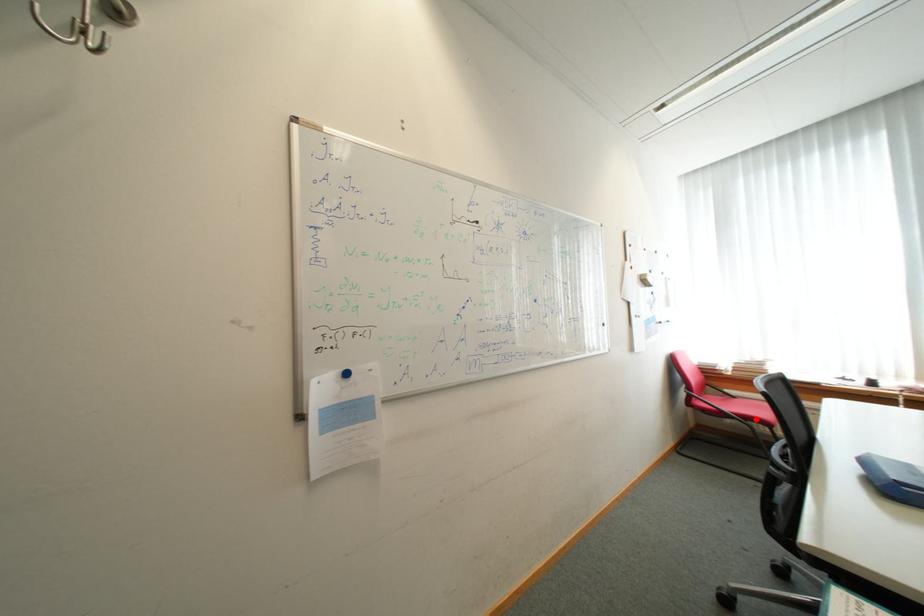
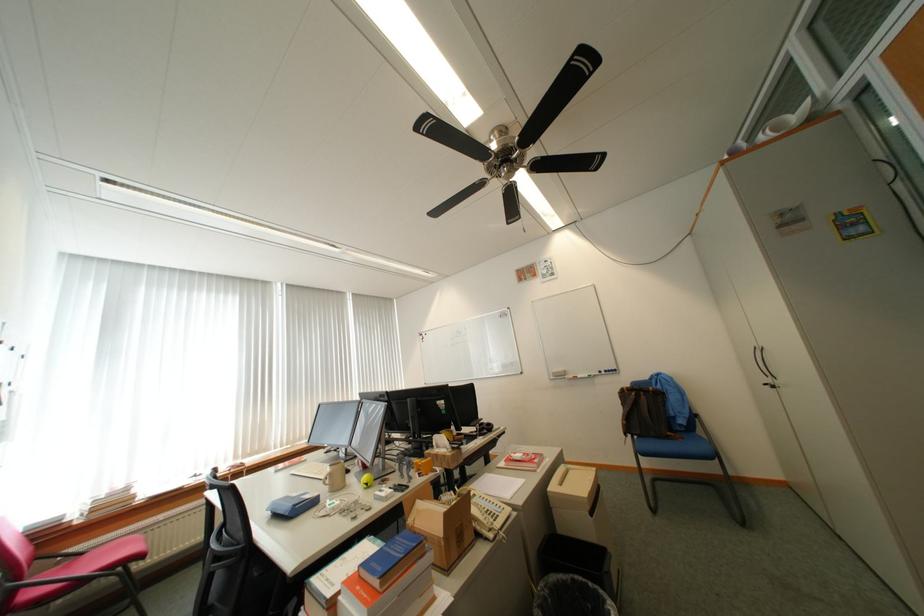
Locate, in the second image, the point that corresponds to the highlighted location in the first image.

(123, 567)